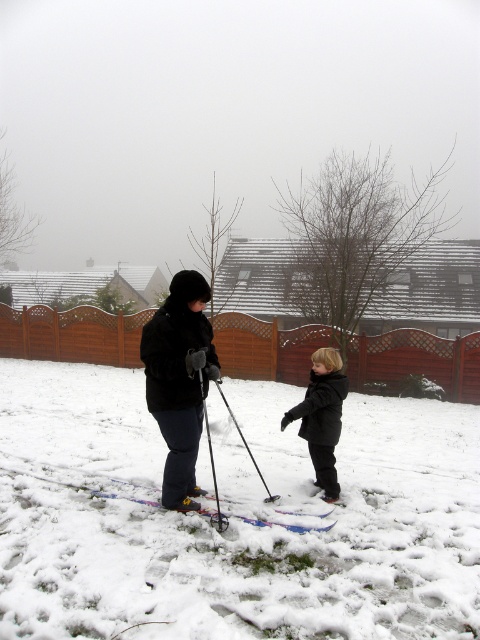
Can you confirm if black fuzzy coat at center is positioned below metallic silver ski pole at center?

No, black fuzzy coat at center is not below metallic silver ski pole at center.

Can you confirm if black fuzzy coat at center is taller than metallic silver ski pole at center?

Yes.

The width and height of the screenshot is (480, 640). Describe the element at coordinates (322, 417) in the screenshot. I see `black fuzzy coat at center` at that location.

The image size is (480, 640). I want to click on black fuzzy coat at center, so click(x=322, y=417).

Can you confirm if black plastic ski pole at center is smaller than metallic silver ski pole at center?

Actually, black plastic ski pole at center might be larger than metallic silver ski pole at center.

Is black plastic ski pole at center to the left of metallic silver ski pole at center from the viewer's perspective?

Indeed, black plastic ski pole at center is positioned on the left side of metallic silver ski pole at center.

Which is behind, point (203, 412) or point (241, 436)?

Point (241, 436)

At what (x,y) coordinates should I click in order to perform the action: click on black plastic ski pole at center. Please return your answer as a coordinate pair (x, y). Looking at the image, I should click on (212, 465).

Is white fluffy snow at center positioned in front of black plastic ski pole at center?

Yes.

Between point (451, 561) and point (216, 484), which one is positioned in front?

Point (451, 561) is in front.

I want to click on white fluffy snow at center, so click(x=231, y=518).